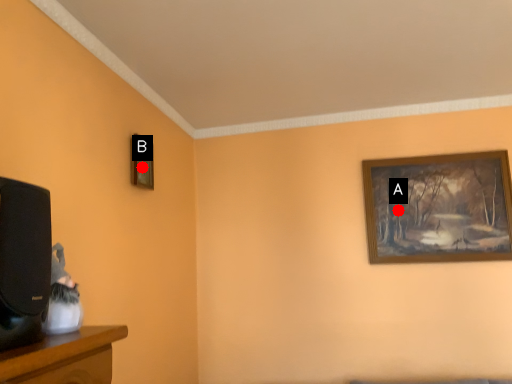
Question: Two points are circled on the image, labeled by A and B beside each circle. Which of the following is the closest to the observer?

Choices:
 (A) A is closer
 (B) B is closer

Answer: (B)